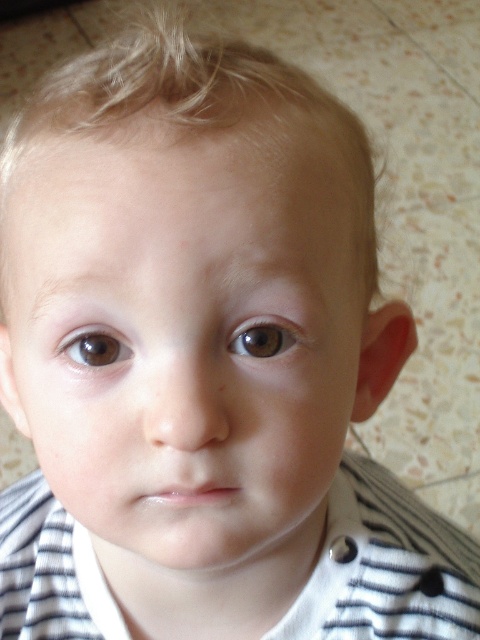
You are an artist trying to sketch the child in the image. To ensure accuracy, you need to know the position of the brown matte eye at center relative to the frame. Can you determine if it is positioned closer to the top or bottom half of the image?

The brown matte eye at center is located at point coordinates 0.528 on the x and 0.552 on the y. Since the y coordinate is above 0.5, it is positioned in the upper half of the image, closer to the top.

What object is located at the coordinates point (264,337) in the image?

The point (264,337) corresponds to the brown matte eye at center.